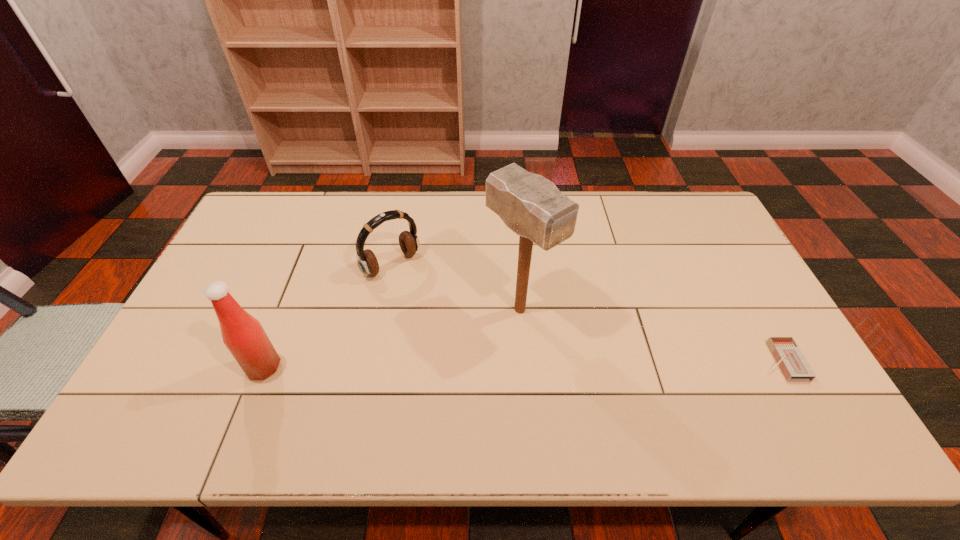
This screenshot has height=540, width=960. In order to click on condiment that is positioned at the near edge in this screenshot , I will do `click(243, 335)`.

At what (x,y) coordinates should I click in order to perform the action: click on matchbox situated at the near edge. Please return your answer as a coordinate pair (x, y). The width and height of the screenshot is (960, 540). Looking at the image, I should click on (789, 358).

The height and width of the screenshot is (540, 960). Identify the location of object at the right edge. (789, 358).

Image resolution: width=960 pixels, height=540 pixels. Find the location of `object at the near right corner`. object at the near right corner is located at coordinates (789, 358).

You are a GUI agent. You are given a task and a screenshot of the screen. Output one action in this format:
    pyautogui.click(x=<x>, y=<y>)
    Task: Click on the vacant space at the far edge of the desktop
    This screenshot has height=540, width=960.
    Given the screenshot: What is the action you would take?
    pyautogui.click(x=329, y=212)

The width and height of the screenshot is (960, 540). In order to click on vacant region at the near edge of the desktop in this screenshot , I will do `click(721, 380)`.

I want to click on free region at the left edge of the desktop, so click(263, 242).

In the image, there is a desktop. Where is `free space at the right edge`? This screenshot has width=960, height=540. free space at the right edge is located at coordinates (736, 363).

Where is `free space at the near left corner of the desktop`? This screenshot has width=960, height=540. free space at the near left corner of the desktop is located at coordinates (209, 382).

The width and height of the screenshot is (960, 540). I want to click on vacant space that's between the leftmost object and the rightmost object, so click(x=521, y=364).